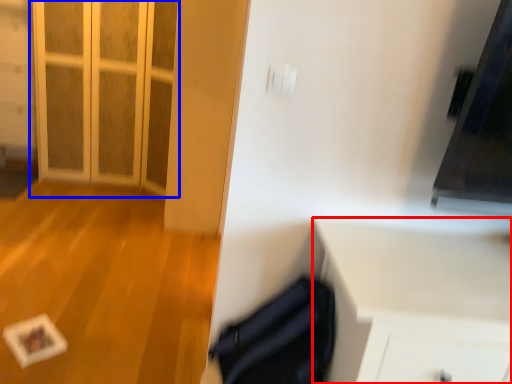
Question: Which point is closer to the camera, cabinetry (highlighted by a red box) or door (highlighted by a blue box)?

Choices:
 (A) cabinetry
 (B) door

Answer: (A)